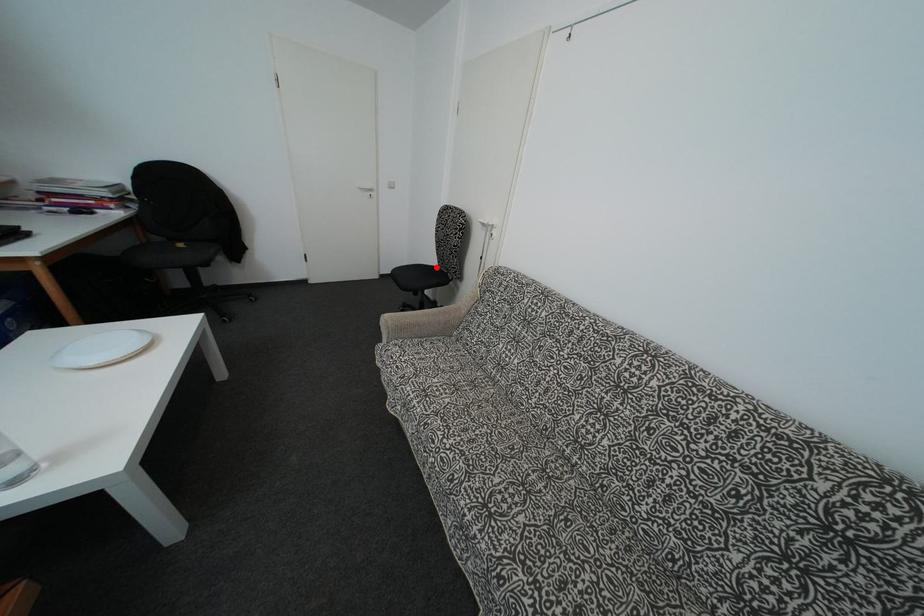
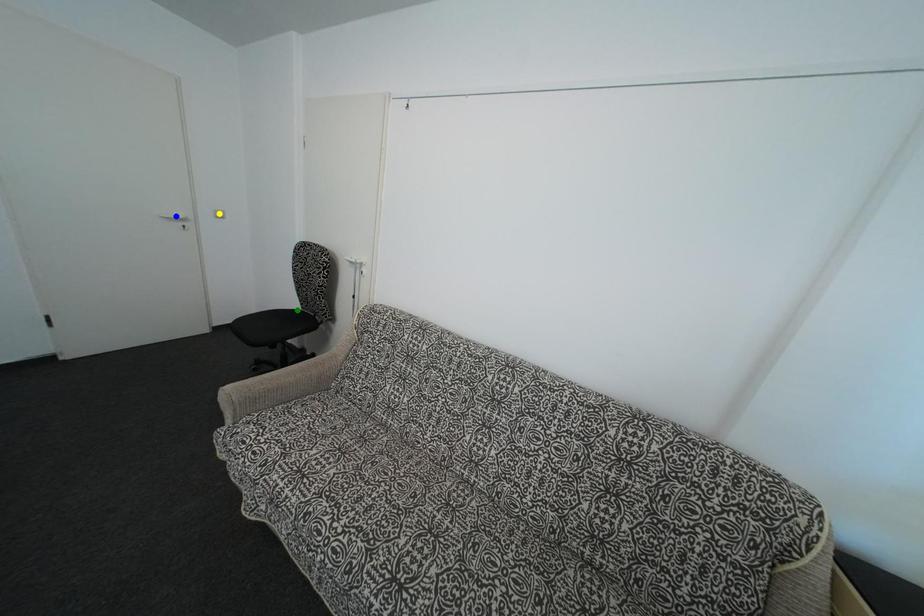
Question: I am providing you with two images of the same scene from different viewpoints. A red point is marked on the first image. You are given multiple points on the second image. Which point in image 2 is actually the same real-world point as the red point in image 1?

Choices:
 (A) blue point
 (B) yellow point
 (C) green point

Answer: (C)